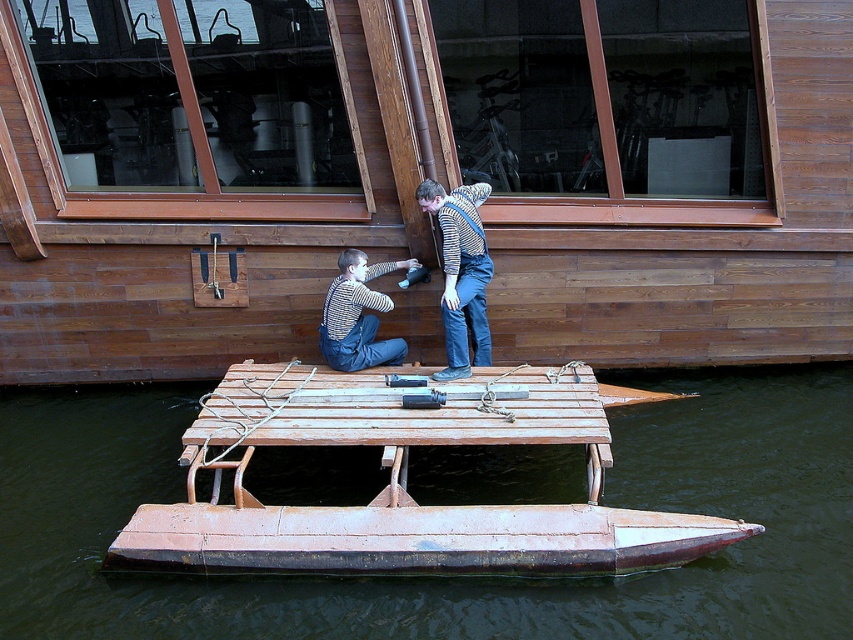
Who is higher up, rusty metal raft at center or wooden at center?

wooden at center is above.

Who is more forward, (379, 588) or (366, 413)?

Positioned in front is point (379, 588).

This screenshot has width=853, height=640. In order to click on rusty metal raft at center in this screenshot , I will do `click(450, 579)`.

Which is above, wooden at center or striped sweater at center?

striped sweater at center is above.

In the scene shown: Can you confirm if wooden at center is bigger than striped sweater at center?

Yes.

The height and width of the screenshot is (640, 853). Describe the element at coordinates (389, 419) in the screenshot. I see `wooden at center` at that location.

What are the coordinates of `wooden at center` in the screenshot? It's located at (389, 419).

Is point (657, 509) closer to camera compared to point (341, 371)?

That is True.

Who is more distant from viewer, (689,429) or (345,268)?

The point (689,429) is more distant.

Locate an element on the screen. The height and width of the screenshot is (640, 853). rusty metal raft at center is located at coordinates (450, 579).